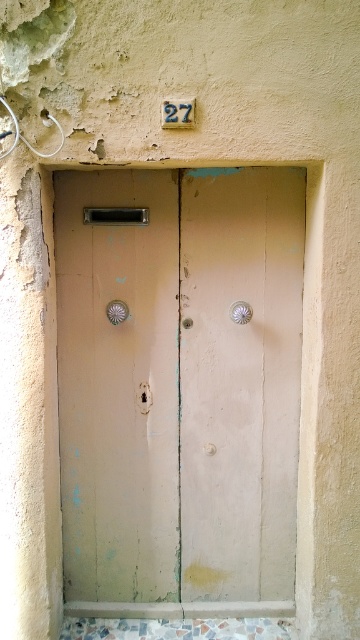
Question: Which object is closer to the camera taking this photo?

Choices:
 (A) metallic silver door handle at center
 (B) matte silver door handle at center

Answer: (A)

Question: Does matte pink wood door at center appear under matte silver door handle at center?

Choices:
 (A) no
 (B) yes

Answer: (B)

Question: Is matte pink wood door at center to the right of matte silver door handle at center from the viewer's perspective?

Choices:
 (A) yes
 (B) no

Answer: (A)

Question: Does matte silver door handle at center have a larger size compared to metallic silver door handle at center?

Choices:
 (A) yes
 (B) no

Answer: (A)

Question: Which object appears farthest from the camera in this image?

Choices:
 (A) matte silver door handle at center
 (B) matte pink wood door at center

Answer: (A)

Question: Which point is farther from the camera taking this photo?

Choices:
 (A) (248, 321)
 (B) (186, 541)

Answer: (B)